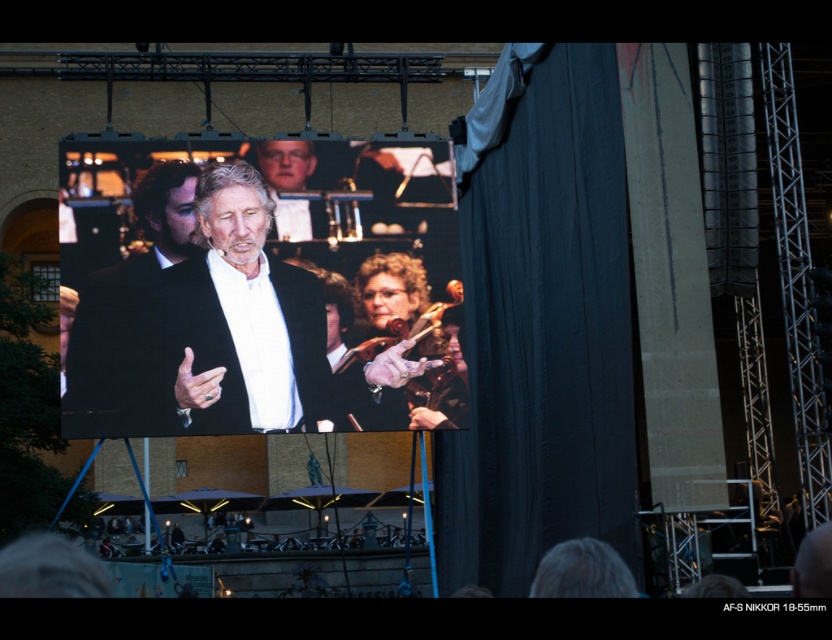
Can you confirm if shiny gold violin at center is wider than smooth skin hand at center?

Yes, shiny gold violin at center is wider than smooth skin hand at center.

Which is more to the left, shiny gold violin at center or smooth skin hand at center?

Positioned to the left is smooth skin hand at center.

Is point (399, 401) in front of point (204, 385)?

No, it is behind (204, 385).

Where is `shiny gold violin at center`? Image resolution: width=832 pixels, height=640 pixels. shiny gold violin at center is located at coordinates (405, 348).

At what (x,y) coordinates should I click in order to perform the action: click on smooth skin hand at center. Please return your answer as a coordinate pair (x, y). This screenshot has height=640, width=832. Looking at the image, I should click on (196, 385).

Which is above, smooth skin hand at center or matte black hand at center?

smooth skin hand at center is higher up.

Measure the distance between point [189,372] and camera.

The distance of point [189,372] from camera is 55.62 meters.

Where is `smooth skin hand at center`? Image resolution: width=832 pixels, height=640 pixels. smooth skin hand at center is located at coordinates (196, 385).

Based on the photo, who is taller, matte black suit at center or leather glove at center?

Standing taller between the two is leather glove at center.

Which is more to the left, matte black suit at center or leather glove at center?

From the viewer's perspective, matte black suit at center appears more on the left side.

Who is more forward, (231, 276) or (395, 356)?

Point (231, 276) is in front.

Locate an element on the screen. matte black suit at center is located at coordinates (243, 317).